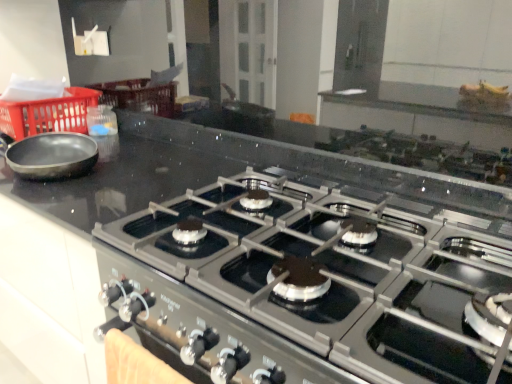
The width and height of the screenshot is (512, 384). I want to click on red plastic basket at left, so click(48, 114).

This screenshot has width=512, height=384. Describe the element at coordinates (48, 114) in the screenshot. I see `red plastic basket at left` at that location.

Image resolution: width=512 pixels, height=384 pixels. I want to click on black stainless steel gas stove at center, so click(308, 283).

From the picture: Measure the distance between black stainless steel gas stove at center and camera.

black stainless steel gas stove at center is 20.39 inches away from camera.

What do you see at coordinates (308, 283) in the screenshot? I see `black stainless steel gas stove at center` at bounding box center [308, 283].

Where is `red plastic basket at left`? red plastic basket at left is located at coordinates (48, 114).

In the image, is red plastic basket at left on the left side or the right side of black stainless steel gas stove at center?

red plastic basket at left is to the left of black stainless steel gas stove at center.

Does red plastic basket at left lie behind black stainless steel gas stove at center?

Yes, red plastic basket at left is further from the camera.

Is point (10, 114) less distant than point (279, 277)?

No, it is behind (279, 277).

From the image's perspective, is red plastic basket at left below black stainless steel gas stove at center?

No, from the image's perspective, red plastic basket at left is not below black stainless steel gas stove at center.

Looking at this image, from a real-world perspective, relative to black stainless steel gas stove at center, is red plastic basket at left vertically above or below?

Clearly, from a real-world perspective, red plastic basket at left is above black stainless steel gas stove at center.

Is red plastic basket at left wider or thinner than black stainless steel gas stove at center?

In the image, red plastic basket at left appears to be more narrow than black stainless steel gas stove at center.

Considering the relative sizes of red plastic basket at left and black stainless steel gas stove at center in the image provided, is red plastic basket at left taller than black stainless steel gas stove at center?

No.

Looking at the image, does red plastic basket at left seem bigger or smaller compared to black stainless steel gas stove at center?

Clearly, red plastic basket at left is smaller in size than black stainless steel gas stove at center.

Is red plastic basket at left spatially inside black stainless steel gas stove at center, or outside of it?

red plastic basket at left is spatially situated outside black stainless steel gas stove at center.

Is red plastic basket at left positioned far away from black stainless steel gas stove at center?

Yes, red plastic basket at left and black stainless steel gas stove at center are located far from each other.

Is red plastic basket at left facing away from black stainless steel gas stove at center?

That's not correct — red plastic basket at left is not looking away from black stainless steel gas stove at center.

What's the angular difference between red plastic basket at left and black stainless steel gas stove at center's facing directions?

The angle between the facing direction of red plastic basket at left and the facing direction of black stainless steel gas stove at center is 6.57e-05 degrees.

How distant is red plastic basket at left from black stainless steel gas stove at center?

The distance of red plastic basket at left from black stainless steel gas stove at center is 1.13 meters.

Identify the location of basket located above the black stainless steel gas stove at center (from the image's perspective). Image resolution: width=512 pixels, height=384 pixels. (48, 114).

Can you confirm if black stainless steel gas stove at center is positioned to the left of red plastic basket at left?

Incorrect, black stainless steel gas stove at center is not on the left side of red plastic basket at left.

Is the depth of black stainless steel gas stove at center less than that of red plastic basket at left?

Yes, black stainless steel gas stove at center is closer to the viewer.

Is point (439, 317) farther from camera compared to point (51, 118)?

That is False.

From the image's perspective, is black stainless steel gas stove at center on red plastic basket at left?

No.

From a real-world perspective, which is physically above, black stainless steel gas stove at center or red plastic basket at left?

In real-world perspective, red plastic basket at left is above.

Does black stainless steel gas stove at center have a greater width compared to red plastic basket at left?

Yes, black stainless steel gas stove at center is wider than red plastic basket at left.

Who is shorter, black stainless steel gas stove at center or red plastic basket at left?

With less height is red plastic basket at left.

Is black stainless steel gas stove at center bigger than red plastic basket at left?

Yes, black stainless steel gas stove at center is bigger than red plastic basket at left.

Is black stainless steel gas stove at center inside or outside of red plastic basket at left?

black stainless steel gas stove at center is not enclosed by red plastic basket at left.

Is black stainless steel gas stove at center touching red plastic basket at left?

No, black stainless steel gas stove at center is not with red plastic basket at left.

Is black stainless steel gas stove at center facing away from red plastic basket at left?

black stainless steel gas stove at center does not have its back to red plastic basket at left.

Where is `gas stove beneath the red plastic basket at left (from a real-world perspective)`? gas stove beneath the red plastic basket at left (from a real-world perspective) is located at coordinates 308,283.

This screenshot has height=384, width=512. I want to click on basket located above the black stainless steel gas stove at center (from the image's perspective), so click(48, 114).

You are a GUI agent. You are given a task and a screenshot of the screen. Output one action in this format:
    pyautogui.click(x=<x>, y=<y>)
    Task: Click on the gas stove in front of the red plastic basket at left
    This screenshot has height=384, width=512.
    Given the screenshot: What is the action you would take?
    pyautogui.click(x=308, y=283)